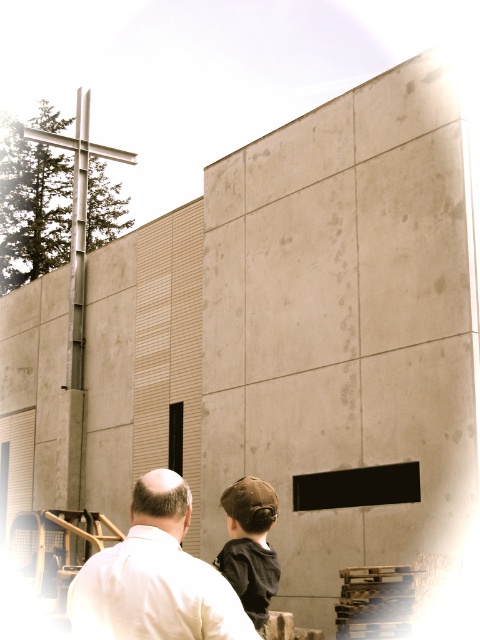
Who is shorter, white matte shirt at lower left or brown fabric cap at center?

With less height is white matte shirt at lower left.

Where is `white matte shirt at lower left`? The width and height of the screenshot is (480, 640). white matte shirt at lower left is located at coordinates (155, 577).

Is point (113, 612) positioned behind point (244, 579)?

No.

Find the location of a particular element. The image size is (480, 640). white matte shirt at lower left is located at coordinates (155, 577).